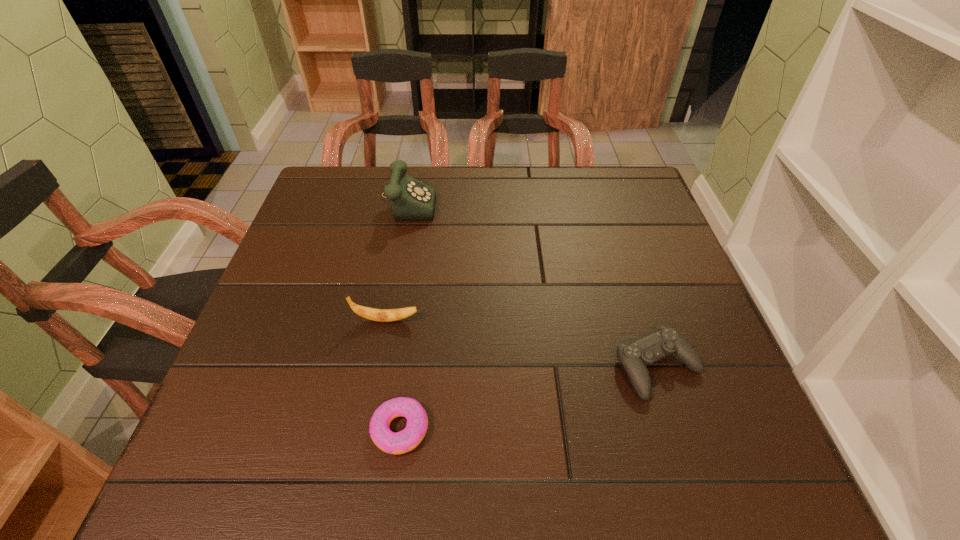
Identify the location of object that is the closest to the farthest object. (381, 315).

The height and width of the screenshot is (540, 960). In order to click on vacant region that satisfies the following two spatial constraints: 1. on the peel of the second farthest object from the top; 2. on the back side of the doughnut in this screenshot , I will do `click(366, 429)`.

Identify the location of free spot that satisfies the following two spatial constraints: 1. on the peel of the second tallest object from the top; 2. on the back side of the control. The image size is (960, 540). (377, 368).

Locate an element on the screen. vacant position in the image that satisfies the following two spatial constraints: 1. on the dial of the farthest object; 2. on the left side of the control is located at coordinates point(377,368).

The width and height of the screenshot is (960, 540). Identify the location of vacant space that satisfies the following two spatial constraints: 1. on the peel of the third shortest object from the top; 2. on the back side of the shortest object. click(x=366, y=429).

At what (x,y) coordinates should I click in order to perform the action: click on free space that satisfies the following two spatial constraints: 1. on the peel of the nearest object from the top; 2. on the right side of the banana. Please return your answer as a coordinate pair (x, y). The width and height of the screenshot is (960, 540). Looking at the image, I should click on (366, 429).

Find the location of a particular element. This screenshot has width=960, height=540. free space that satisfies the following two spatial constraints: 1. on the peel of the second tallest object from the top; 2. on the back side of the doughnut is located at coordinates [x=366, y=429].

At what (x,y) coordinates should I click in order to perform the action: click on free space that satisfies the following two spatial constraints: 1. on the dial of the tallest object; 2. on the right side of the second nearest object. Please return your answer as a coordinate pair (x, y). The image size is (960, 540). Looking at the image, I should click on (377, 368).

Find the location of a particular element. Image resolution: width=960 pixels, height=540 pixels. blank area in the image that satisfies the following two spatial constraints: 1. on the back side of the rightmost object; 2. on the dial of the farthest object is located at coordinates 603,200.

Find the location of a particular element. This screenshot has height=540, width=960. vacant space that satisfies the following two spatial constraints: 1. on the dial of the farthest object; 2. on the right side of the rightmost object is located at coordinates (377, 368).